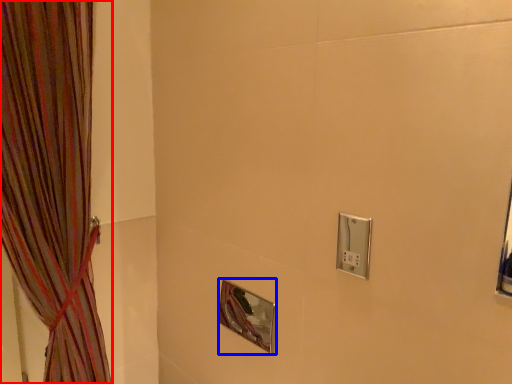
Question: Among these objects, which one is farthest to the camera, curtain (highlighted by a red box) or mirror (highlighted by a blue box)?

Choices:
 (A) curtain
 (B) mirror

Answer: (B)